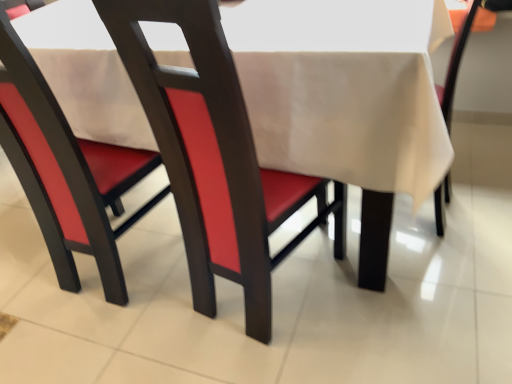
Question: In which direction should I rotate to look at beige fabric chair at center, marked as the 1th chair in a right-to-left arrangement?

Choices:
 (A) right
 (B) left

Answer: (A)

Question: Which direction should I rotate to look at matte red chair at center, acting as the 1th chair starting from the left, — up or down?

Choices:
 (A) up
 (B) down

Answer: (A)

Question: Is matte red chair at center, arranged as the 3th chair when viewed from the right, surrounded by beige fabric chair at center, the 3th chair from the left?

Choices:
 (A) no
 (B) yes

Answer: (A)

Question: Is beige fabric chair at center, marked as the 1th chair in a right-to-left arrangement, behind matte red chair at center, arranged as the 3th chair when viewed from the right?

Choices:
 (A) no
 (B) yes

Answer: (B)

Question: Is beige fabric chair at center, marked as the 1th chair in a right-to-left arrangement, aimed at matte red chair at center, acting as the 1th chair starting from the left?

Choices:
 (A) yes
 (B) no

Answer: (B)

Question: Can you confirm if beige fabric chair at center, marked as the 1th chair in a right-to-left arrangement, is wider than matte red chair at center, arranged as the 3th chair when viewed from the right?

Choices:
 (A) no
 (B) yes

Answer: (B)

Question: Can you confirm if beige fabric chair at center, marked as the 1th chair in a right-to-left arrangement, is positioned to the right of matte red chair at center, acting as the 1th chair starting from the left?

Choices:
 (A) yes
 (B) no

Answer: (A)

Question: Does beige fabric chair at center, marked as the 1th chair in a right-to-left arrangement, appear on the left side of matte red chair at center, arranged as the 3th chair when viewed from the right?

Choices:
 (A) yes
 (B) no

Answer: (B)

Question: Is beige fabric tablecloth at center not close to beige fabric chair at center, the 3th chair from the left?

Choices:
 (A) no
 (B) yes

Answer: (A)

Question: Is beige fabric tablecloth at center at the left side of beige fabric chair at center, marked as the 1th chair in a right-to-left arrangement?

Choices:
 (A) no
 (B) yes

Answer: (B)

Question: Is beige fabric tablecloth at center in contact with beige fabric chair at center, the 3th chair from the left?

Choices:
 (A) yes
 (B) no

Answer: (B)

Question: Does beige fabric tablecloth at center appear on the right side of beige fabric chair at center, marked as the 1th chair in a right-to-left arrangement?

Choices:
 (A) no
 (B) yes

Answer: (A)

Question: Does beige fabric tablecloth at center have a smaller size compared to beige fabric chair at center, the 3th chair from the left?

Choices:
 (A) yes
 (B) no

Answer: (B)

Question: Is beige fabric tablecloth at center not within beige fabric chair at center, the 3th chair from the left?

Choices:
 (A) no
 (B) yes

Answer: (B)

Question: From the image's perspective, is matte red chair at center, arranged as the 3th chair when viewed from the right, beneath matte wood chair at center, which is counted as the second chair, starting from the right?

Choices:
 (A) yes
 (B) no

Answer: (B)